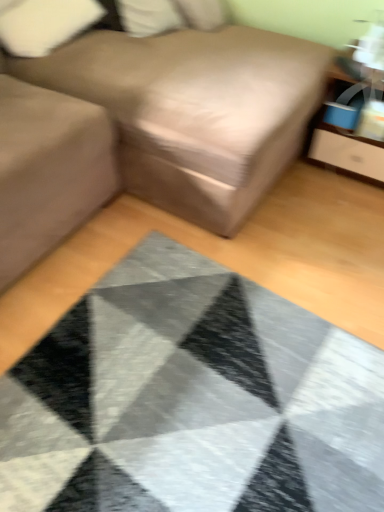
You are a GUI agent. You are given a task and a screenshot of the screen. Output one action in this format:
    pyautogui.click(x=<x>, y=<y>)
    Task: Click on the white soft pillow at upper center, positioned as the 2th pillow in left-to-right order
    The width and height of the screenshot is (384, 512).
    Given the screenshot: What is the action you would take?
    pyautogui.click(x=149, y=17)

What do you see at coordinates (192, 400) in the screenshot? I see `textured gray mat at center` at bounding box center [192, 400].

Locate an element on the screen. matte gray sofa at left is located at coordinates (49, 170).

Does matte gray sofa at left have a lesser width compared to brown fabric couch at center?

Indeed, matte gray sofa at left has a lesser width compared to brown fabric couch at center.

What's the angular difference between matte gray sofa at left and brown fabric couch at center's facing directions?

matte gray sofa at left and brown fabric couch at center are facing 0.000151 degrees away from each other.

Measure the distance between matte gray sofa at left and brown fabric couch at center.

matte gray sofa at left is 15.51 inches from brown fabric couch at center.

Is there a large distance between matte gray sofa at left and brown fabric couch at center?

matte gray sofa at left is actually quite close to brown fabric couch at center.

Is textured gray mat at center to the left or to the right of matte gray sofa at left in the image?

Based on their positions, textured gray mat at center is located to the right of matte gray sofa at left.

What are the coordinates of `gray located behind the textured gray mat at center` in the screenshot? It's located at (49, 170).

Is textured gray mat at center turned away from matte gray sofa at left?

That's not correct — textured gray mat at center is not looking away from matte gray sofa at left.

Is matte gray sofa at left inside textured gray mat at center?

No, matte gray sofa at left is not surrounded by textured gray mat at center.

Is white fabric pillow at upper left, placed as the second pillow when sorted from right to left, far away from textured gray mat at center?

Yes, white fabric pillow at upper left, placed as the second pillow when sorted from right to left, is far from textured gray mat at center.

The image size is (384, 512). There is a textured gray mat at center. What are the coordinates of `the 2nd pillow above it (from a real-world perspective)` in the screenshot? It's located at (44, 24).

From a real-world perspective, is white fabric pillow at upper left, placed as the second pillow when sorted from right to left, positioned over textured gray mat at center based on gravity?

Yes, from a real-world perspective, white fabric pillow at upper left, placed as the second pillow when sorted from right to left, is on top of textured gray mat at center.

Consider the image. Is white fabric pillow at upper left, the first pillow in the left-to-right sequence, turned away from textured gray mat at center?

No, white fabric pillow at upper left, the first pillow in the left-to-right sequence, is not facing the opposite direction of textured gray mat at center.

From the picture: Is white fabric pillow at upper left, placed as the second pillow when sorted from right to left, wider or thinner than brown fabric couch at center?

Considering their sizes, white fabric pillow at upper left, placed as the second pillow when sorted from right to left, looks slimmer than brown fabric couch at center.

Looking at this image, between white fabric pillow at upper left, the first pillow in the left-to-right sequence, and brown fabric couch at center, which one appears on the right side from the viewer's perspective?

brown fabric couch at center.

Image resolution: width=384 pixels, height=512 pixels. In order to click on the 2nd pillow located above the brown fabric couch at center (from a real-world perspective) in this screenshot , I will do `click(44, 24)`.

Is brown fabric couch at center closer to camera compared to white fabric pillow at upper left, the first pillow in the left-to-right sequence?

Yes, brown fabric couch at center is in front of white fabric pillow at upper left, the first pillow in the left-to-right sequence.

Visually, is brown fabric couch at center positioned to the left or to the right of white fabric pillow at upper left, placed as the second pillow when sorted from right to left?

Clearly, brown fabric couch at center is on the right of white fabric pillow at upper left, placed as the second pillow when sorted from right to left, in the image.

Considering the sizes of brown fabric couch at center and white fabric pillow at upper left, the first pillow in the left-to-right sequence, in the image, is brown fabric couch at center bigger or smaller than white fabric pillow at upper left, the first pillow in the left-to-right sequence,?

Clearly, brown fabric couch at center is larger in size than white fabric pillow at upper left, the first pillow in the left-to-right sequence.

Is point (287, 408) behind point (55, 30)?

No.

From the picture: Choose the correct answer: Is textured gray mat at center inside white fabric pillow at upper left, placed as the second pillow when sorted from right to left, or outside it?

textured gray mat at center is not enclosed by white fabric pillow at upper left, placed as the second pillow when sorted from right to left.

From a real-world perspective, who is located lower, textured gray mat at center or white fabric pillow at upper left, placed as the second pillow when sorted from right to left?

textured gray mat at center, from a real-world perspective.

From a real-world perspective, is white soft pillow at upper center, positioned as the 2th pillow in left-to-right order, above or below textured gray mat at center?

In terms of real-world spatial position, white soft pillow at upper center, positioned as the 2th pillow in left-to-right order, is above textured gray mat at center.

Could you tell me if white soft pillow at upper center, positioned as the 2th pillow in left-to-right order, is facing textured gray mat at center?

Yes, white soft pillow at upper center, positioned as the 2th pillow in left-to-right order, is aimed at textured gray mat at center.

From the image's perspective, is white soft pillow at upper center, the first pillow in the right-to-left sequence, located beneath textured gray mat at center?

Actually, white soft pillow at upper center, the first pillow in the right-to-left sequence, appears above textured gray mat at center in the image.

Between white soft pillow at upper center, positioned as the 2th pillow in left-to-right order, and textured gray mat at center, which one appears on the right side from the viewer's perspective?

textured gray mat at center.

Identify the location of gray below the brown fabric couch at center (from the image's perspective). This screenshot has width=384, height=512. (49, 170).

I want to click on gray above the textured gray mat at center (from a real-world perspective), so click(49, 170).

Looking at the image, which one is located further to brown fabric couch at center, white soft pillow at upper center, the first pillow in the right-to-left sequence, or matte gray sofa at left?

white soft pillow at upper center, the first pillow in the right-to-left sequence, is further to brown fabric couch at center.

Based on their spatial positions, is brown fabric couch at center or matte wood dresser at upper right closer to matte gray sofa at left?

Among the two, brown fabric couch at center is located nearer to matte gray sofa at left.

Based on their spatial positions, is white soft pillow at upper center, positioned as the 2th pillow in left-to-right order, or textured gray mat at center further from brown fabric couch at center?

Based on the image, textured gray mat at center appears to be further to brown fabric couch at center.

Based on the photo, considering their positions, is white fabric pillow at upper left, placed as the second pillow when sorted from right to left, positioned further to matte wood dresser at upper right than textured gray mat at center?

white fabric pillow at upper left, placed as the second pillow when sorted from right to left, lies further to matte wood dresser at upper right than the other object.

Based on their spatial positions, is matte gray sofa at left or white soft pillow at upper center, positioned as the 2th pillow in left-to-right order, further from matte wood dresser at upper right?

matte gray sofa at left.

From the image, which object appears to be farther from white fabric pillow at upper left, placed as the second pillow when sorted from right to left, white soft pillow at upper center, the first pillow in the right-to-left sequence, or textured gray mat at center?

textured gray mat at center lies further to white fabric pillow at upper left, placed as the second pillow when sorted from right to left, than the other object.

From the image, which object appears to be nearer to matte wood dresser at upper right, white soft pillow at upper center, the first pillow in the right-to-left sequence, or white fabric pillow at upper left, the first pillow in the left-to-right sequence?

white soft pillow at upper center, the first pillow in the right-to-left sequence, is positioned closer to the anchor matte wood dresser at upper right.

From the picture: Considering their positions, is white fabric pillow at upper left, placed as the second pillow when sorted from right to left, positioned further to textured gray mat at center than matte wood dresser at upper right?

white fabric pillow at upper left, placed as the second pillow when sorted from right to left, is positioned further to the anchor textured gray mat at center.

Identify the location of studio couch between matte gray sofa at left and white soft pillow at upper center, the first pillow in the right-to-left sequence, along the z-axis. (195, 111).

You are a GUI agent. You are given a task and a screenshot of the screen. Output one action in this format:
    pyautogui.click(x=<x>, y=<y>)
    Task: Click on the gray between white fabric pillow at upper left, the first pillow in the left-to-right sequence, and textured gray mat at center in the up-down direction
    Image resolution: width=384 pixels, height=512 pixels.
    Given the screenshot: What is the action you would take?
    pyautogui.click(x=49, y=170)

Find the location of a particular element. This screenshot has height=512, width=384. dresser between white fabric pillow at upper left, the first pillow in the left-to-right sequence, and textured gray mat at center in the up-down direction is located at coordinates (343, 151).

Where is `dresser between brown fabric couch at center and textured gray mat at center from top to bottom`? The image size is (384, 512). dresser between brown fabric couch at center and textured gray mat at center from top to bottom is located at coordinates (343, 151).